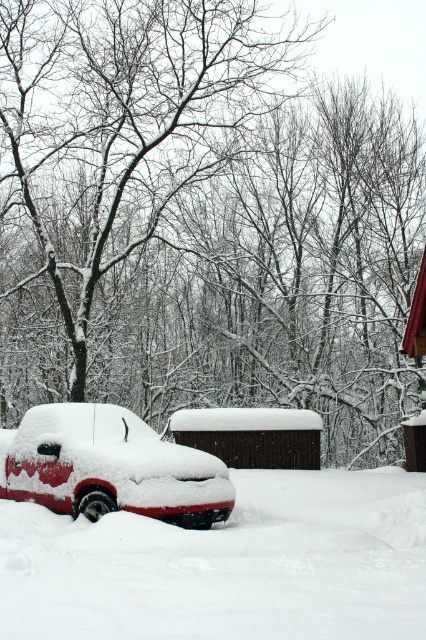
Does snow-covered tree at center have a greater width compared to white fluffy snow at lower center?

Yes, snow-covered tree at center is wider than white fluffy snow at lower center.

Is snow-covered tree at center further to the viewer compared to white fluffy snow at lower center?

Yes, it is behind white fluffy snow at lower center.

Who is more distant from viewer, (34, 16) or (388, 557)?

The point (34, 16) is behind.

The width and height of the screenshot is (426, 640). Find the location of `snow-covered tree at center`. snow-covered tree at center is located at coordinates 204,220.

Who is more distant from viewer, (140, 540) or (278, 458)?

The point (278, 458) is behind.

Describe the element at coordinates (227, 564) in the screenshot. The image size is (426, 640). I see `white fluffy snow at lower center` at that location.

Where is `white fluffy snow at lower center`? Image resolution: width=426 pixels, height=640 pixels. white fluffy snow at lower center is located at coordinates (227, 564).

Is white fluffy snow at lower center smaller than snow-covered red truck at lower left?

Correct, white fluffy snow at lower center occupies less space than snow-covered red truck at lower left.

What do you see at coordinates (227, 564) in the screenshot? I see `white fluffy snow at lower center` at bounding box center [227, 564].

Does point (324, 600) lie in front of point (55, 472)?

That is True.

This screenshot has width=426, height=640. I want to click on white fluffy snow at lower center, so pos(227,564).